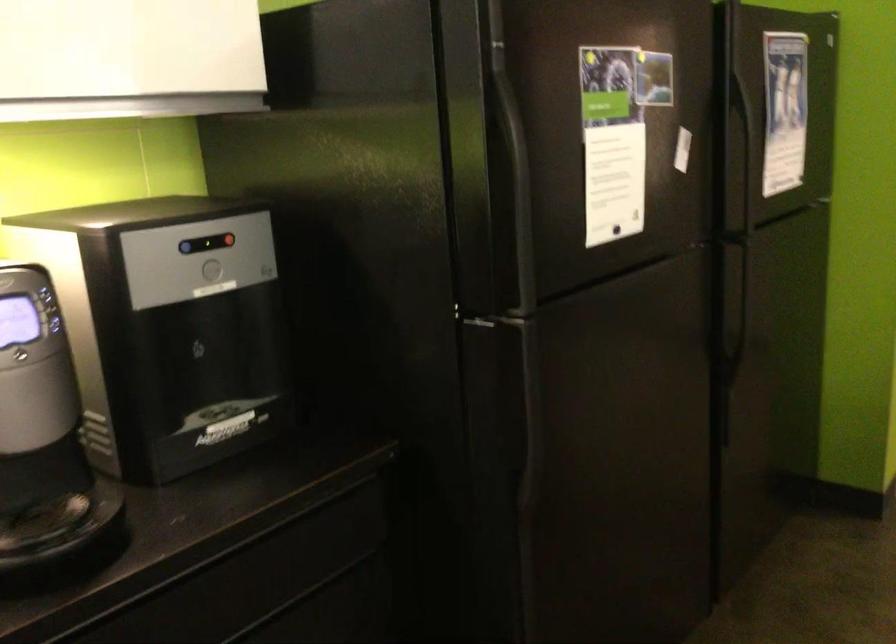
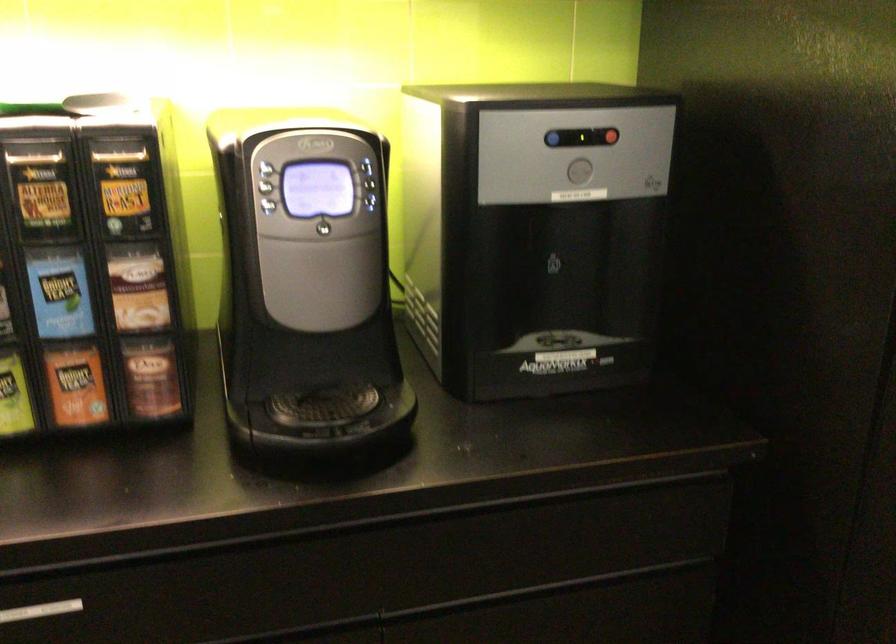
The point at (x=211, y=272) is marked in the first image. Where is the corresponding point in the second image?

(579, 172)